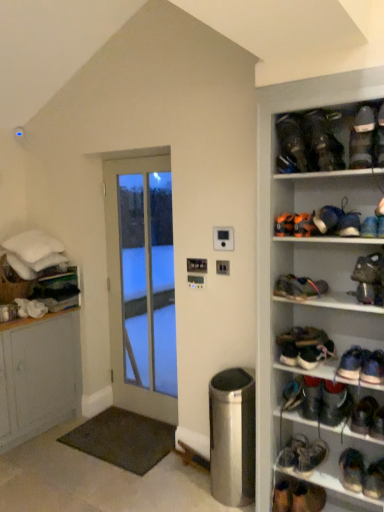
Question: Looking at their shapes, would you say blue suede sneaker at upper right, the 6th footwear when ordered from top to bottom, is wider or thinner than blue suede shoe at upper right, acting as the fifth footwear starting from the top?

Choices:
 (A) thin
 (B) wide

Answer: (A)

Question: Considering the positions of point (355, 230) and point (317, 219), is point (355, 230) closer or farther from the camera than point (317, 219)?

Choices:
 (A) closer
 (B) farther

Answer: (A)

Question: Considering the real-world distances, which object is closest to the white glass door at center?

Choices:
 (A) shiny black shoe at right, the 5th footwear when ordered from bottom to top
 (B) blue suede sneaker at upper right, the fifteenth footwear in the bottom-to-top sequence
 (C) dark brown leather shoe at center right, marked as the 11th footwear in a top-to-bottom arrangement
 (D) multicolored fabric shoe at center right, which appears as the twelfth footwear when ordered from the bottom
 (E) blue suede sneakers at lower right, which is the 7th footwear in bottom-to-top order

Answer: (C)

Question: Which object is positioned closest to the orange suede shoe at upper right, acting as the seventeenth footwear starting from the bottom?

Choices:
 (A) blue suede sneaker at upper right, the 6th footwear when ordered from top to bottom
 (B) matte black sneaker at lower right, marked as the 19th footwear in a top-to-bottom arrangement
 (C) silver metallic trash can at center-right
 (D) orange matte shoe at upper center, the fourteenth footwear in the bottom-to-top sequence
 (E) dark brown leather shoe at lower right, which is the 8th footwear in bottom-to-top order

Answer: (D)